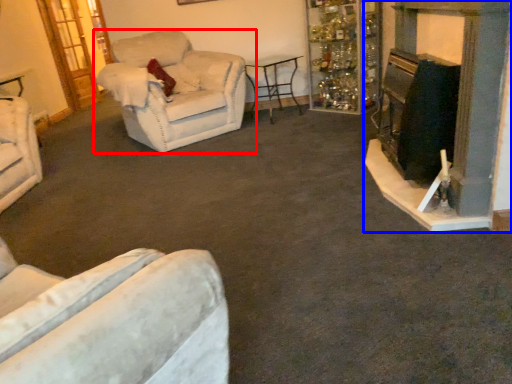
Question: Which of the following is the closest to the observer, chair (highlighted by a red box) or fireplace (highlighted by a blue box)?

Choices:
 (A) chair
 (B) fireplace

Answer: (B)